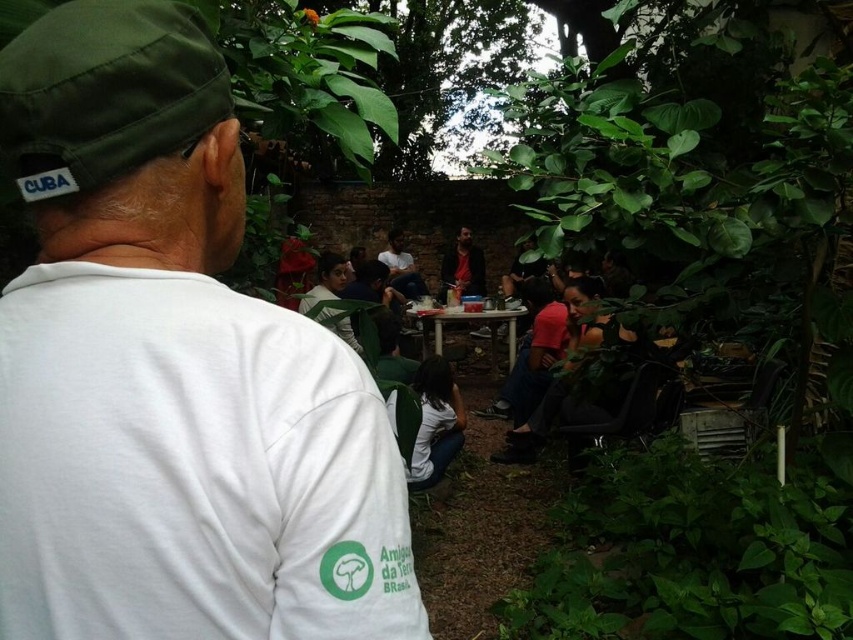
You are standing in the garden and want to reach a specific point marked at coordinates point [222,572]. If your arm is 15 inches long, can you reach that point without moving your feet?

The distance of point [222,572] from viewer is 16.28 inches, so you cannot reach it with your arm which is 15 inches long without moving your feet.